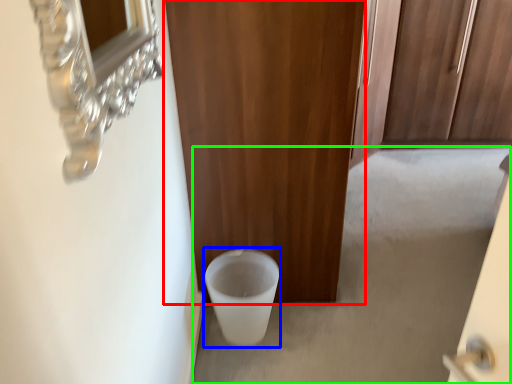
Question: Which object is positioned closest to door (highlighted by a red box)? Select from toilet bowl (highlighted by a blue box) and concrete (highlighted by a green box).

Choices:
 (A) toilet bowl
 (B) concrete

Answer: (A)